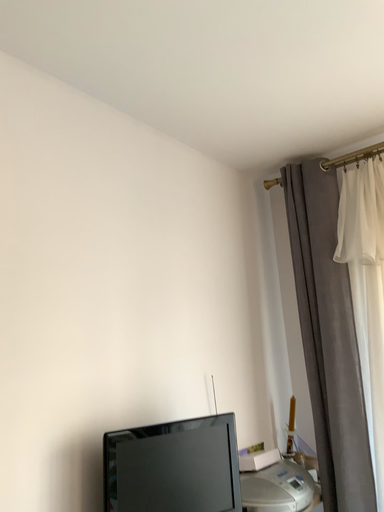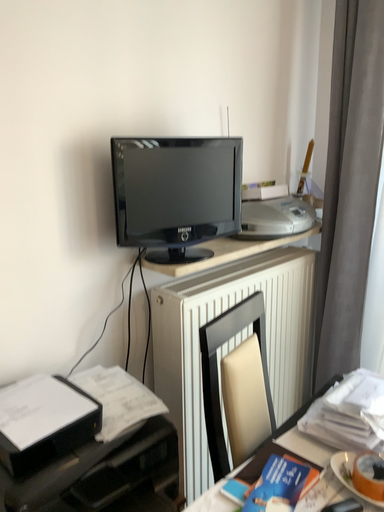
Question: Which way did the camera rotate in the video?

Choices:
 (A) rotated upward
 (B) rotated downward

Answer: (B)